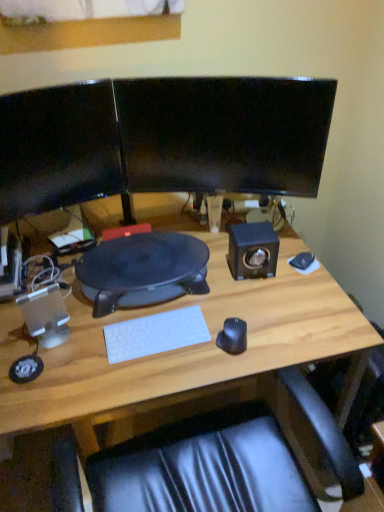
Identify the location of vacant space to the left of black matte mouse at center. (181, 357).